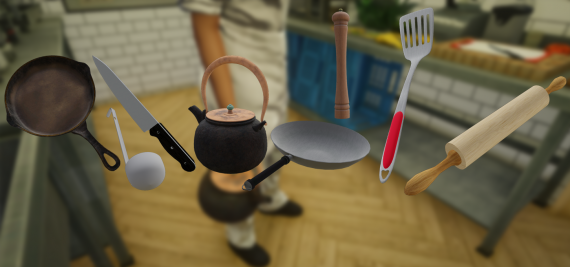
You are a GUI agent. You are given a task and a screenshot of the screen. Output one action in this format:
    pyautogui.click(x=<x>, y=<y>)
    Task: Click on the rolling pin
    Image resolution: width=570 pixels, height=267 pixels.
    Given the screenshot: What is the action you would take?
    pyautogui.click(x=465, y=148)